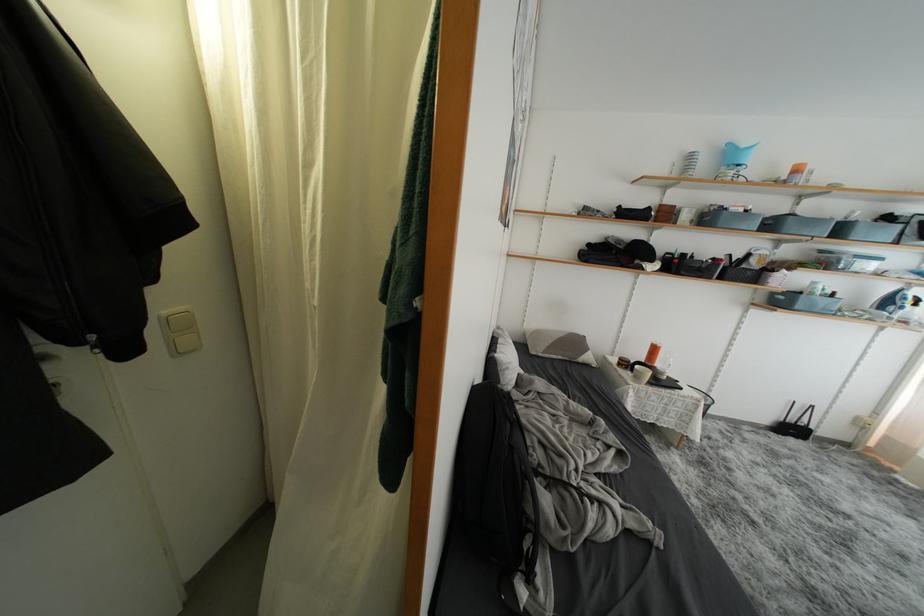
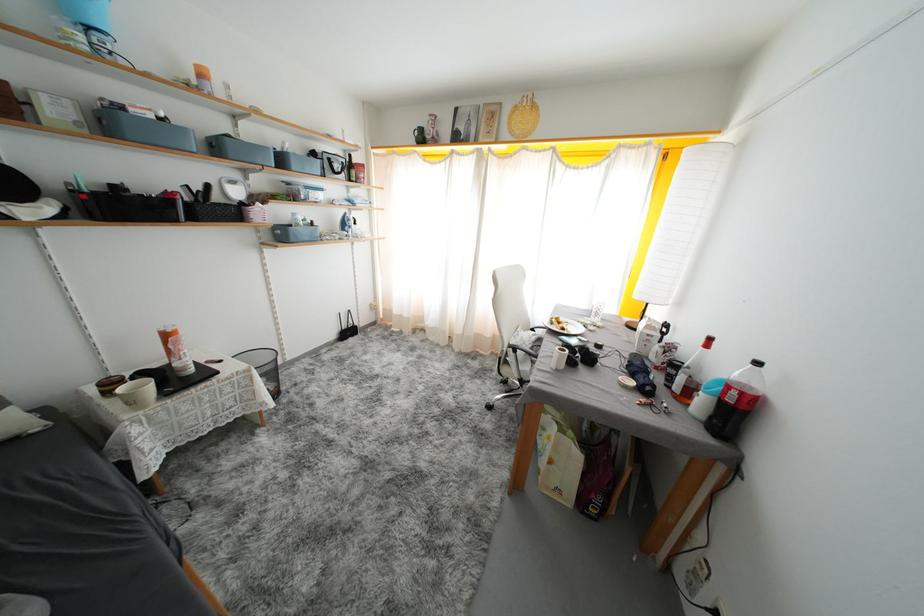
The images are taken continuously from a first-person perspective. In which direction is your viewpoint rotating?

The camera rotated toward right-down.